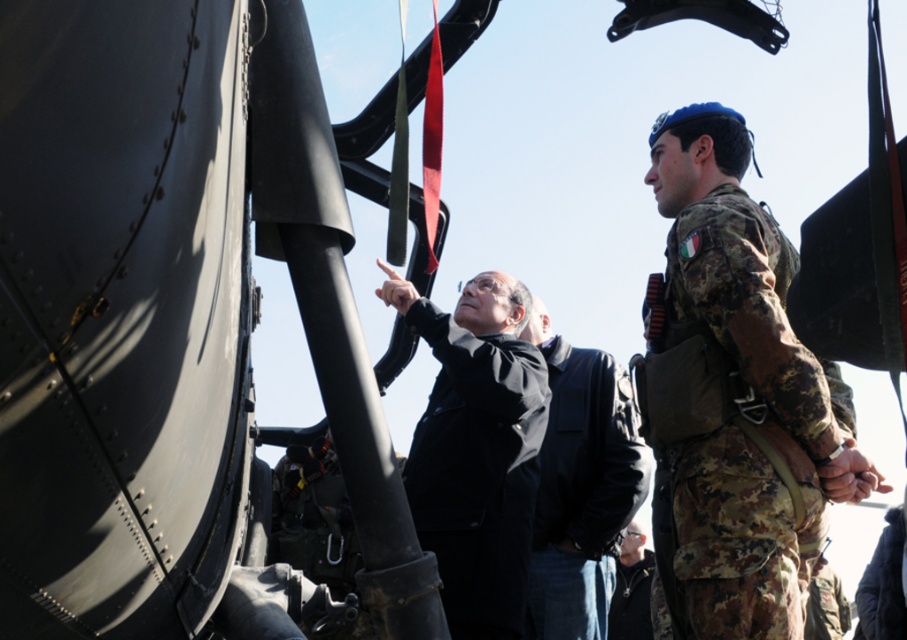
Question: Among these points, which one is nearest to the camera?

Choices:
 (A) (754, 618)
 (B) (584, 470)
 (C) (640, 532)
 (D) (504, 460)

Answer: (A)

Question: Can you confirm if camo fabric uniform at right is positioned to the right of black leather jacket at center?

Choices:
 (A) no
 (B) yes

Answer: (B)

Question: Is camo fabric uniform at right below black leather jacket at center?

Choices:
 (A) yes
 (B) no

Answer: (B)

Question: Which object appears closest to the camera in this image?

Choices:
 (A) shiny black sunglasses at center
 (B) camouflage fabric uniform at center

Answer: (B)

Question: From the image, what is the correct spatial relationship of black leather jacket at center in relation to shiny black sunglasses at center?

Choices:
 (A) left
 (B) right

Answer: (A)

Question: Which object appears closest to the camera in this image?

Choices:
 (A) shiny black sunglasses at center
 (B) black leather jacket at center
 (C) camouflage fabric uniform at center

Answer: (C)